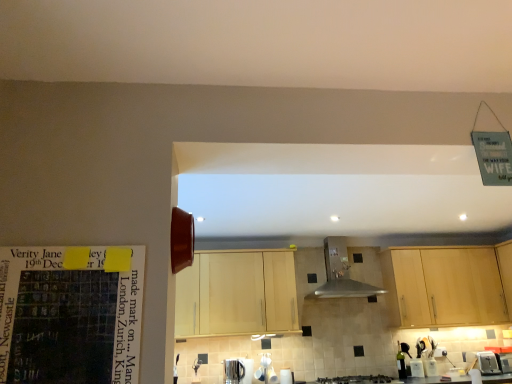
Question: Relative to matte paper calendar at left, is black matte gas stove at lower center in front or behind?

Choices:
 (A) front
 (B) behind

Answer: (B)

Question: Which is correct: black matte gas stove at lower center is inside matte paper calendar at left, or outside of it?

Choices:
 (A) outside
 (B) inside

Answer: (A)

Question: Considering the real-world distances, which object is farthest from the metallic stainless steel kettle at lower center, placed as the second appliance when sorted from right to left?

Choices:
 (A) light wood cabinet at center, acting as the 1th cabinetry starting from the left
 (B) white glossy kettle at lower center, which appears as the 2th appliance when viewed from the left
 (C) stainless steel vent at center
 (D) green glass bottle at lower right
 (E) matte paper calendar at left

Answer: (E)

Question: Based on their relative distances, which object is farther from the metallic stainless steel kettle at lower center, which is counted as the first appliance, starting from the left?

Choices:
 (A) light wood cabinet at center, arranged as the first cabinetry when viewed from the right
 (B) black matte gas stove at lower center
 (C) stainless steel vent at center
 (D) light wood cabinet at center, acting as the 2th cabinetry starting from the right
 (E) white glossy kettle at lower center, which appears as the 2th appliance when viewed from the left

Answer: (A)